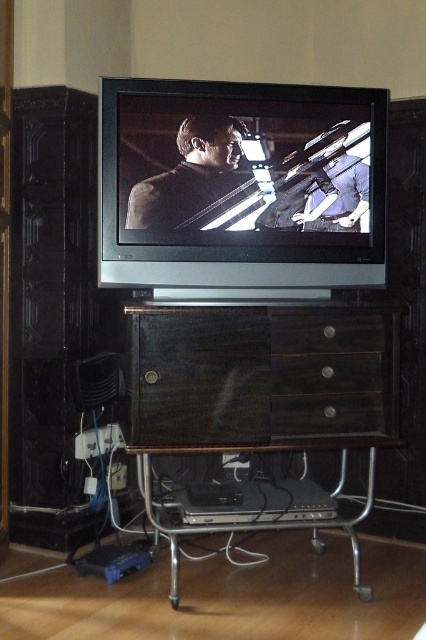
You are moving furniture in the living room and need to place a new sofa that is 1.5 meters wide. The sofa must be placed between the dark wood cabinet at center and the matte black suit at center. Can the sofa fit in the space between them?

The dark wood cabinet at center is wider than the matte black suit at center. However, the exact distance between them isn generated from the provided information. Therefore, it is impossible to determine if the sofa will fit without additional measurements.

You are standing in the living room and want to place a new remote control on the dark wood drawer at center. Based on the coordinates provided, where should you aim to place it?

The dark wood drawer at center is located at coordinates point (330, 374), so you should aim for that position to place the remote control there.